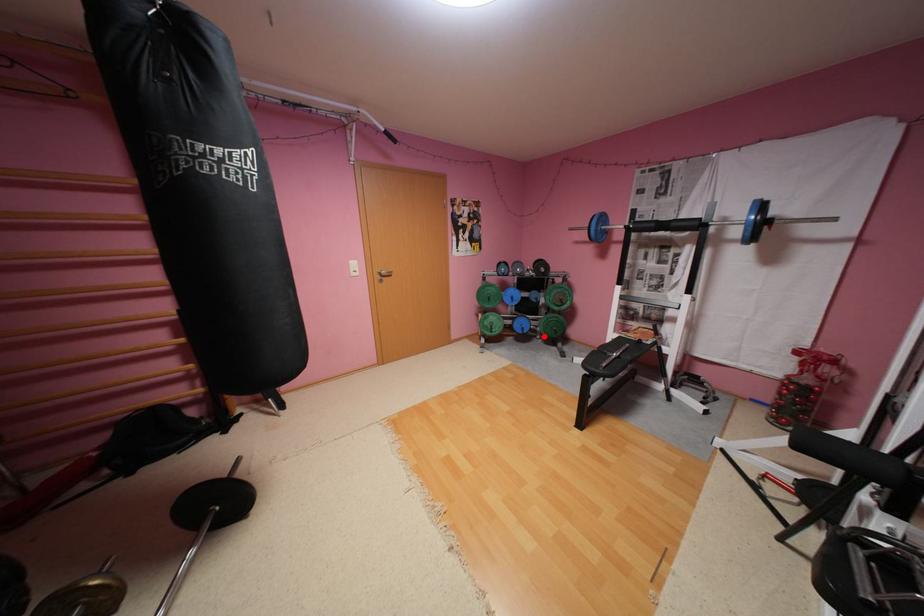
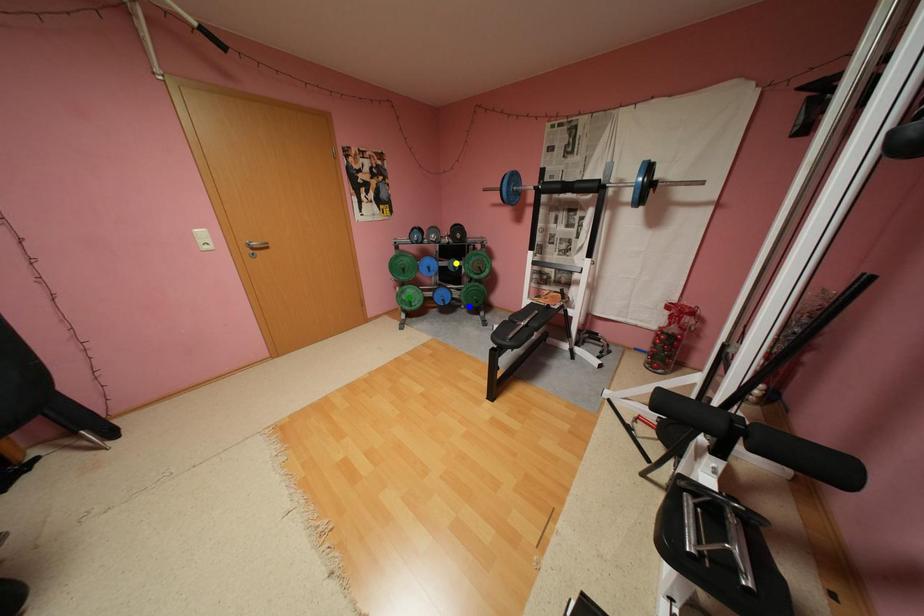
Question: I am providing you with two images of the same scene from different viewpoints. A red point is marked on the first image. You are given multiple points on the second image. Which point in image 2 represents the same 3d spot as the red point in image 1?

Choices:
 (A) green point
 (B) yellow point
 (C) blue point

Answer: (C)